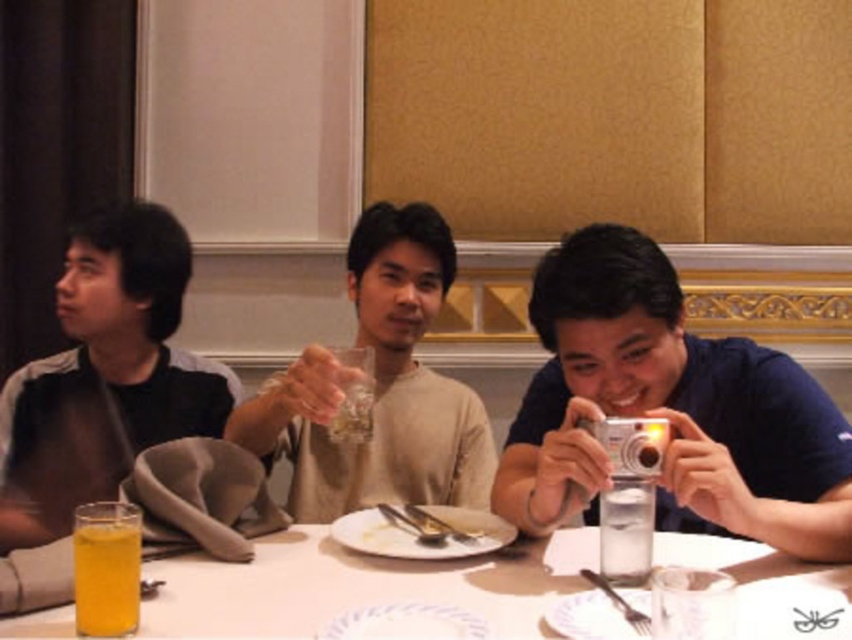
Is silver metallic camera at right to the right of white porcelain plate at center from the viewer's perspective?

Yes, silver metallic camera at right is to the right of white porcelain plate at center.

Can you confirm if silver metallic camera at right is wider than white porcelain plate at center?

Correct, the width of silver metallic camera at right exceeds that of white porcelain plate at center.

You are a GUI agent. You are given a task and a screenshot of the screen. Output one action in this format:
    pyautogui.click(x=<x>, y=<y>)
    Task: Click on the silver metallic camera at right
    This screenshot has width=852, height=640.
    Given the screenshot: What is the action you would take?
    pyautogui.click(x=669, y=410)

Is clear glass at center to the left of white porcelain plate at center from the viewer's perspective?

In fact, clear glass at center is to the right of white porcelain plate at center.

Is point (602, 540) closer to viewer compared to point (436, 522)?

Yes, it is in front of point (436, 522).

Find the location of a particular element. clear glass at center is located at coordinates (626, 531).

Can you confirm if translucent yellow liquid at lower left is positioned to the left of white porcelain plate at center?

Yes, translucent yellow liquid at lower left is to the left of white porcelain plate at center.

Does point (79, 532) lie in front of point (387, 515)?

Yes, point (79, 532) is closer to viewer.

The image size is (852, 640). In order to click on translucent yellow liquid at lower left in this screenshot , I will do `click(106, 568)`.